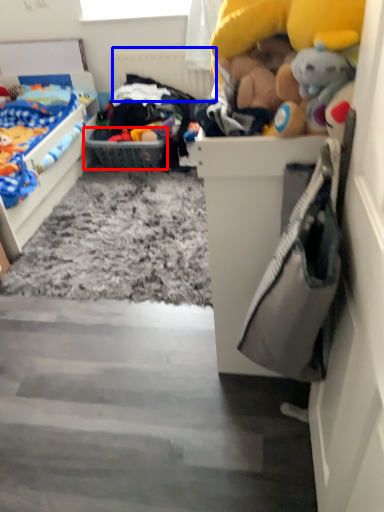
Question: Among these objects, which one is farthest to the camera, picnic basket (highlighted by a red box) or radiator (highlighted by a blue box)?

Choices:
 (A) picnic basket
 (B) radiator

Answer: (B)